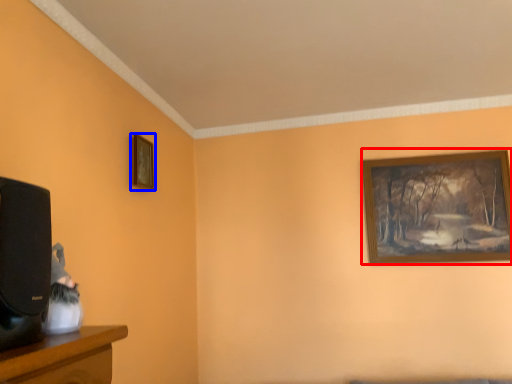
Question: Among these objects, which one is nearest to the camera, picture frame (highlighted by a red box) or picture frame (highlighted by a blue box)?

Choices:
 (A) picture frame
 (B) picture frame

Answer: (B)